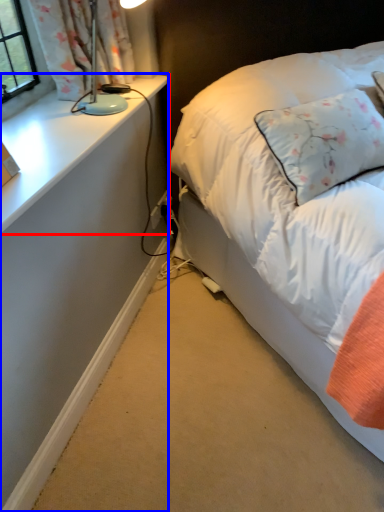
Question: Which object is further to the camera taking this photo, table (highlighted by a red box) or desk (highlighted by a blue box)?

Choices:
 (A) table
 (B) desk

Answer: (B)